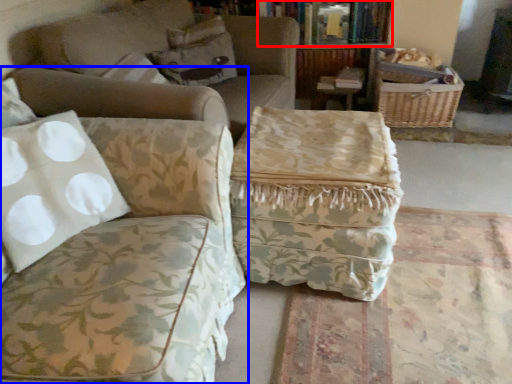
Question: Among these objects, which one is nearest to the camera, book (highlighted by a red box) or studio couch (highlighted by a blue box)?

Choices:
 (A) book
 (B) studio couch

Answer: (B)